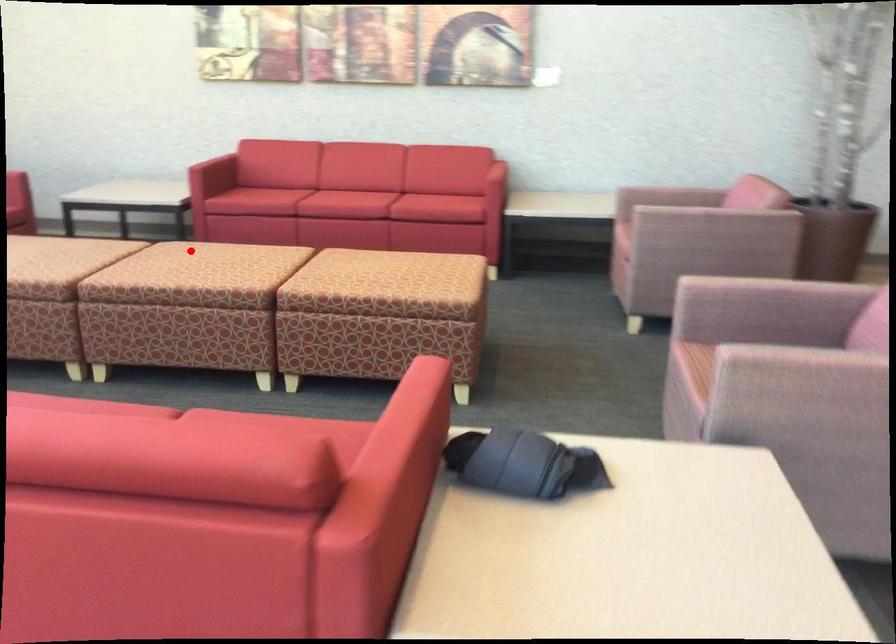
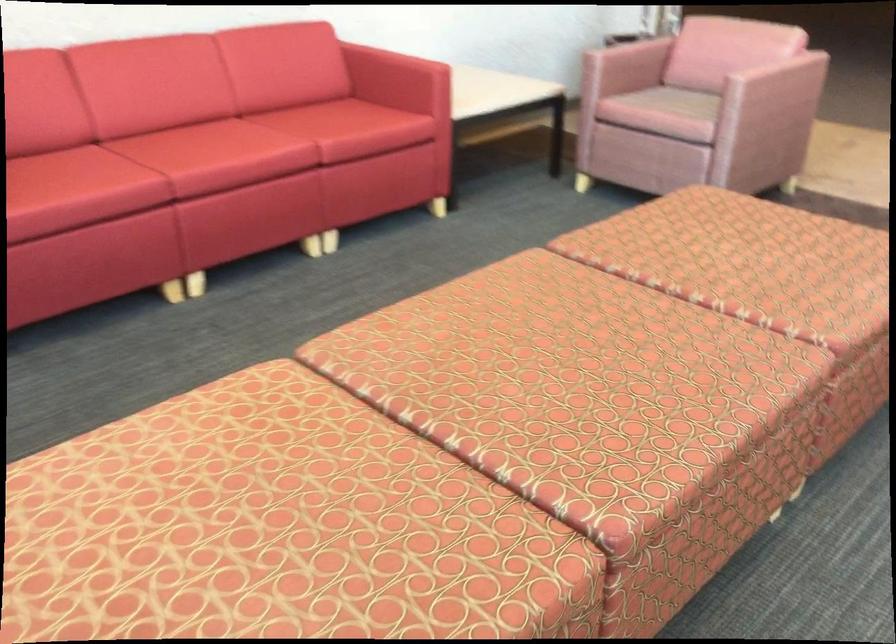
Where in the second image is the point corresponding to the highlighted location from the first image?

(549, 377)